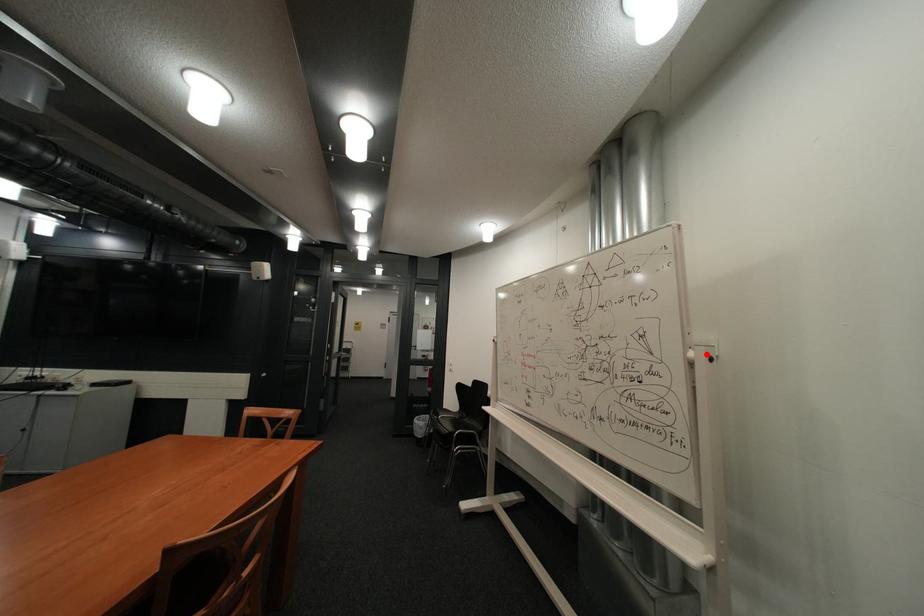
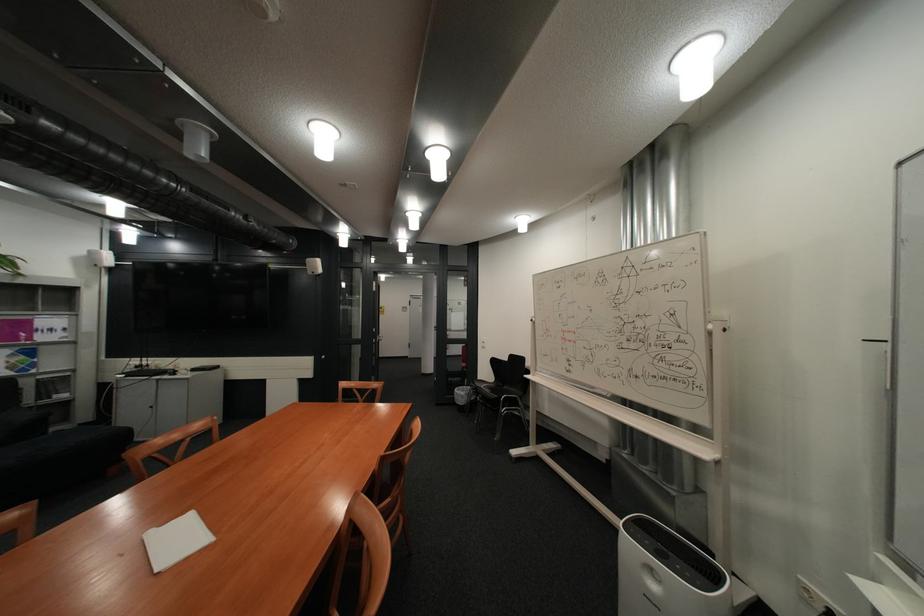
The point at the highlighted location is marked in the first image. Where is the corresponding point in the second image?

(725, 326)